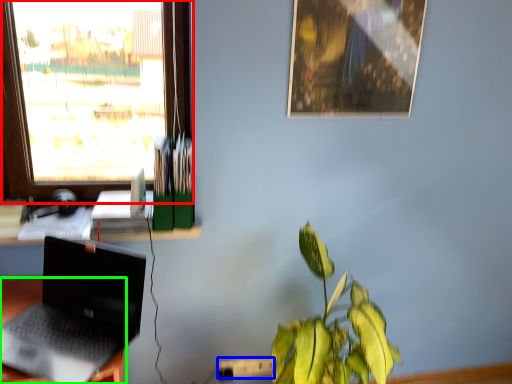
Question: Which object is positioned farthest from window (highlighted by a red box)? Select from power outlet (highlighted by a blue box) and desk (highlighted by a green box).

Choices:
 (A) power outlet
 (B) desk

Answer: (A)